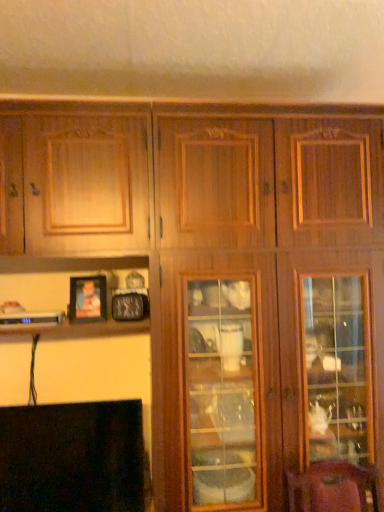
Question: In terms of width, does wooden photo frame at lower left look wider or thinner when compared to black glossy fireplace at lower left?

Choices:
 (A) wide
 (B) thin

Answer: (B)

Question: From the image's perspective, is wooden photo frame at lower left above or below black glossy fireplace at lower left?

Choices:
 (A) below
 (B) above

Answer: (B)

Question: Considering the positions of point (89, 301) and point (59, 452), is point (89, 301) closer or farther from the camera than point (59, 452)?

Choices:
 (A) farther
 (B) closer

Answer: (A)

Question: From a real-world perspective, is black glossy fireplace at lower left positioned above or below wooden photo frame at lower left?

Choices:
 (A) below
 (B) above

Answer: (A)

Question: In the image, is black glossy fireplace at lower left positioned in front of or behind wooden photo frame at lower left?

Choices:
 (A) behind
 (B) front

Answer: (B)

Question: Visually, is black glossy fireplace at lower left positioned to the left or to the right of wooden photo frame at lower left?

Choices:
 (A) left
 (B) right

Answer: (A)

Question: Does point (92, 480) appear closer or farther from the camera than point (102, 309)?

Choices:
 (A) farther
 (B) closer

Answer: (B)